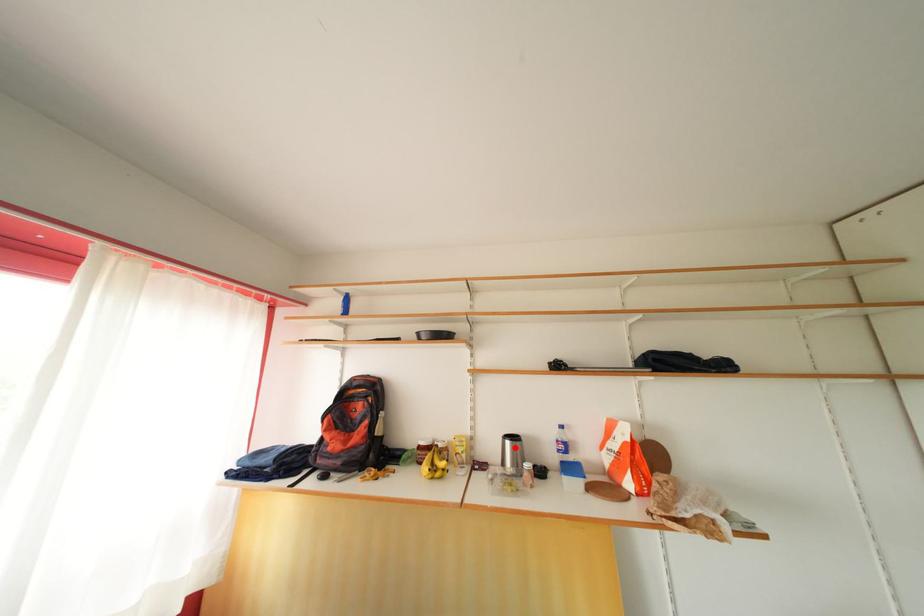
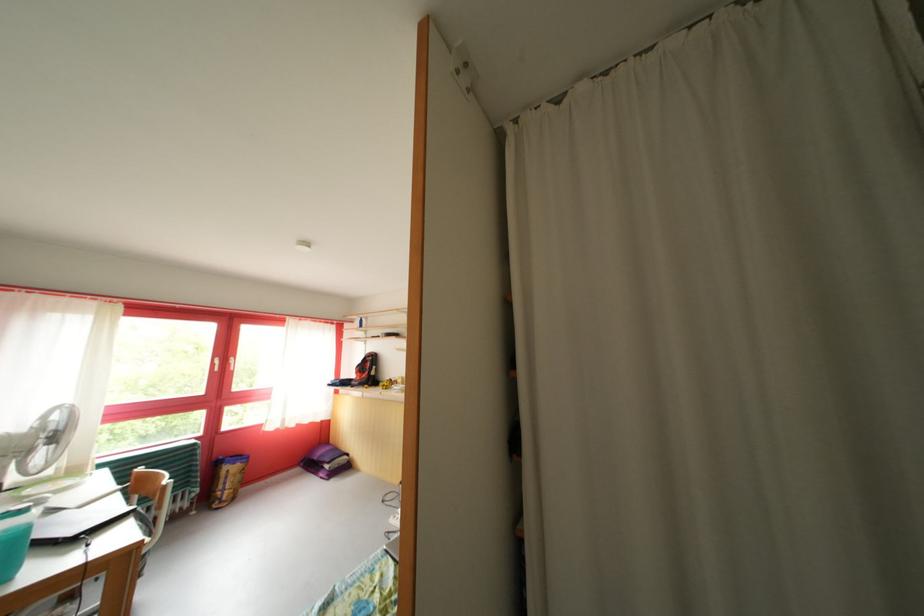
Question: I am providing you with two images of the same scene from different viewpoints. A red point is marked on the first image. At the location where the point appears in image 1, is it still visible in image 2?

Choices:
 (A) Yes
 (B) No

Answer: (B)